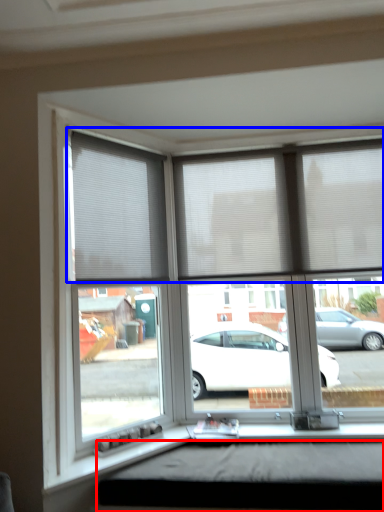
Question: Which object appears closest to the camera in this image, window box (highlighted by a red box) or blind (highlighted by a blue box)?

Choices:
 (A) window box
 (B) blind

Answer: (A)